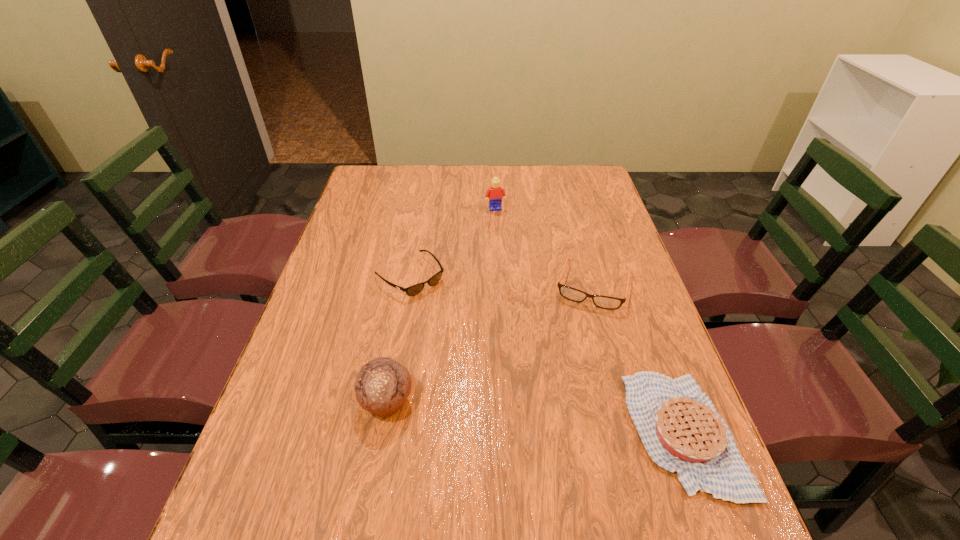
In order to click on free space on the desktop that is between the muffin and the pie and is positioned on the front-facing side of the spectacles in this screenshot , I will do `click(558, 419)`.

Locate an element on the screen. Image resolution: width=960 pixels, height=540 pixels. vacant spot on the desktop that is between the muffin and the pie and is positioned on the front-facing side of the sunglasses is located at coordinates tap(564, 420).

Find the location of a particular element. This screenshot has height=540, width=960. vacant space on the desktop that is between the muffin and the pie and is positioned on the front-facing side of the farthest object is located at coordinates (550, 418).